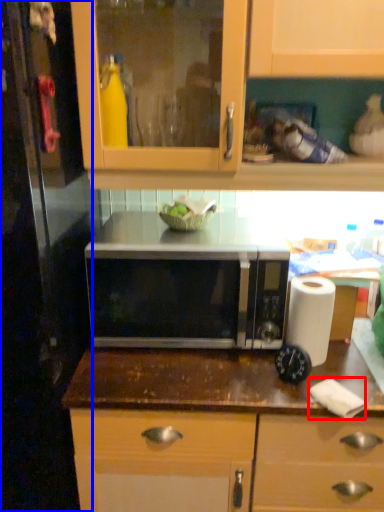
Question: Which point is further to the camera, toilet paper (highlighted by a red box) or glass door (highlighted by a blue box)?

Choices:
 (A) toilet paper
 (B) glass door

Answer: (A)